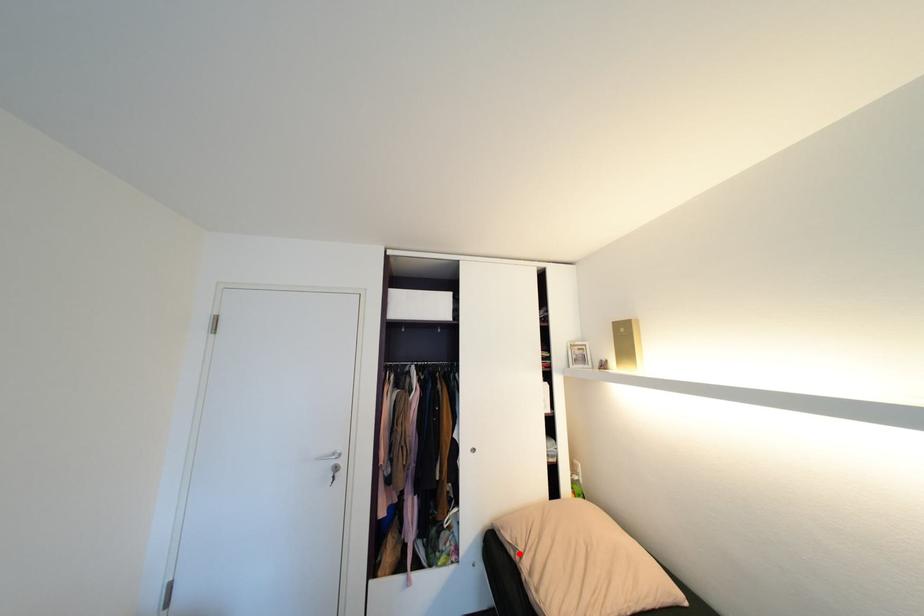
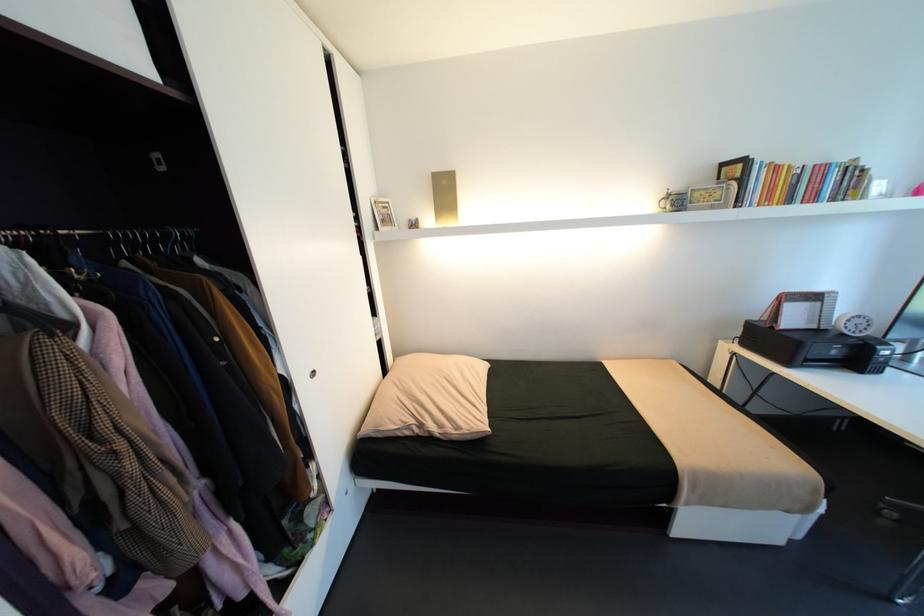
Where in the second image is the point corresponding to the highlighted location from the first image?

(415, 432)